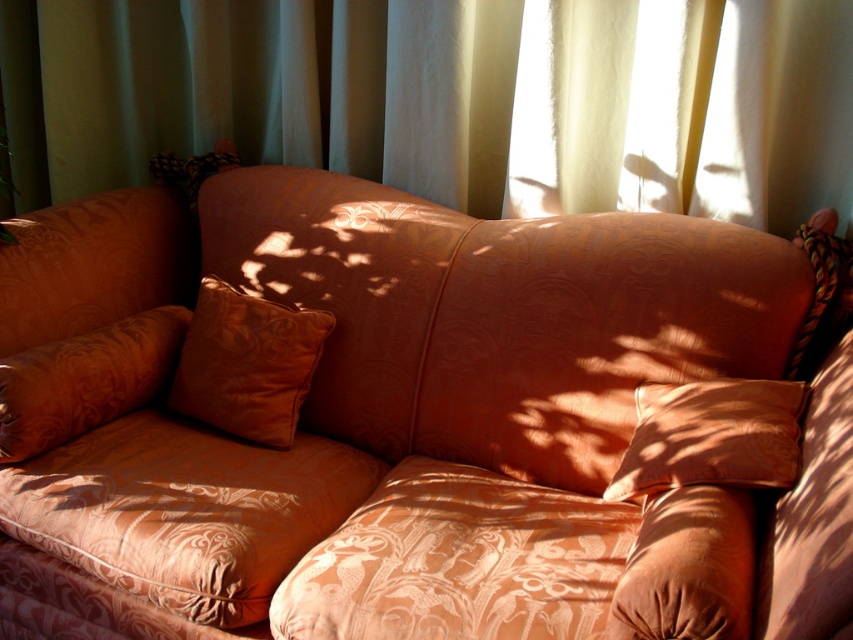
You are standing in the room and want to know the exact position of the white sheer curtain at upper center. Can you tell me its coordinates?

The white sheer curtain at upper center is located at coordinates point (451, 99).

You are standing in the cozy corner of the room and want to place a small decorative item between the two points, point (526, 140) and point (759, 451). Which point should the item be closer to in order to be placed in front of the other point?

The item should be closer to point (759, 451) because point (526, 140) is behind point (759, 451), so placing it near the front point would ensure it is in front.

You are arranging a small table in the corner of the room where the matte orange couch at center and the satin orange pillow at lower right are located. The table needs to be placed between them. Considering their sizes, which object should the table be closer to?

The table should be placed closer to the satin orange pillow at lower right because the matte orange couch at center is larger in size and requires more space between them.